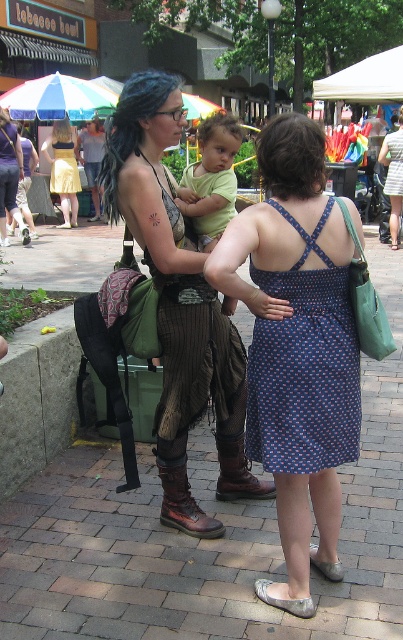
You are a photographer trying to capture both the leather boots at center and the blue dotted fabric dress at center in the same frame. Which object should you adjust your camera angle to focus on first if you want to include both in your shot?

Since the leather boots at center is positioned on the left side of blue dotted fabric dress at center, you should first focus on the blue dotted fabric dress at center to ensure both objects are captured in the frame.

Please describe the position of the light green fabric shirt at center in the image using the coordinate system where the bottom left corner is the origin point. The coordinates should be in the format of a point with two decimal places, such as point 0.3,0.6.

The light green fabric shirt at center is located at point (211, 179).